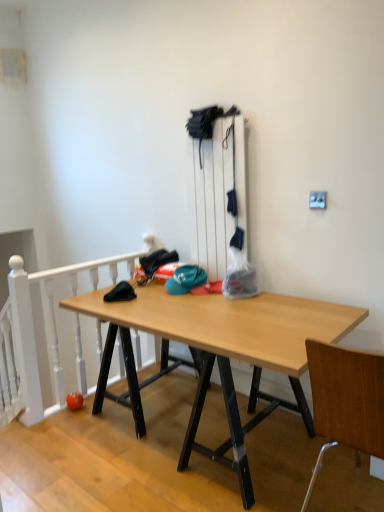
Question: Should I look upward or downward to see wooden at right?

Choices:
 (A) down
 (B) up

Answer: (A)

Question: Would you say wooden desk at center contains wooden at right?

Choices:
 (A) no
 (B) yes

Answer: (A)

Question: From the image's perspective, is wooden desk at center under wooden at right?

Choices:
 (A) no
 (B) yes

Answer: (B)

Question: Would you say wooden desk at center is outside wooden at right?

Choices:
 (A) no
 (B) yes

Answer: (B)

Question: Is wooden desk at center further to the viewer compared to wooden at right?

Choices:
 (A) no
 (B) yes

Answer: (A)

Question: Is wooden desk at center aimed at wooden at right?

Choices:
 (A) no
 (B) yes

Answer: (A)

Question: Is there a large distance between wooden desk at center and wooden at right?

Choices:
 (A) yes
 (B) no

Answer: (B)

Question: Would you consider white painted wood at left to be distant from teal fabric cap at center?

Choices:
 (A) yes
 (B) no

Answer: (B)

Question: Can you confirm if white painted wood at left is thinner than teal fabric cap at center?

Choices:
 (A) yes
 (B) no

Answer: (A)

Question: From a real-world perspective, is white painted wood at left over teal fabric cap at center?

Choices:
 (A) yes
 (B) no

Answer: (B)

Question: Does white painted wood at left appear on the left side of teal fabric cap at center?

Choices:
 (A) no
 (B) yes

Answer: (B)

Question: Is white painted wood at left located outside teal fabric cap at center?

Choices:
 (A) no
 (B) yes

Answer: (B)

Question: From a real-world perspective, does white painted wood at left sit lower than teal fabric cap at center?

Choices:
 (A) yes
 (B) no

Answer: (A)

Question: Does wooden at right have a greater height compared to teal fabric cap at center?

Choices:
 (A) no
 (B) yes

Answer: (B)